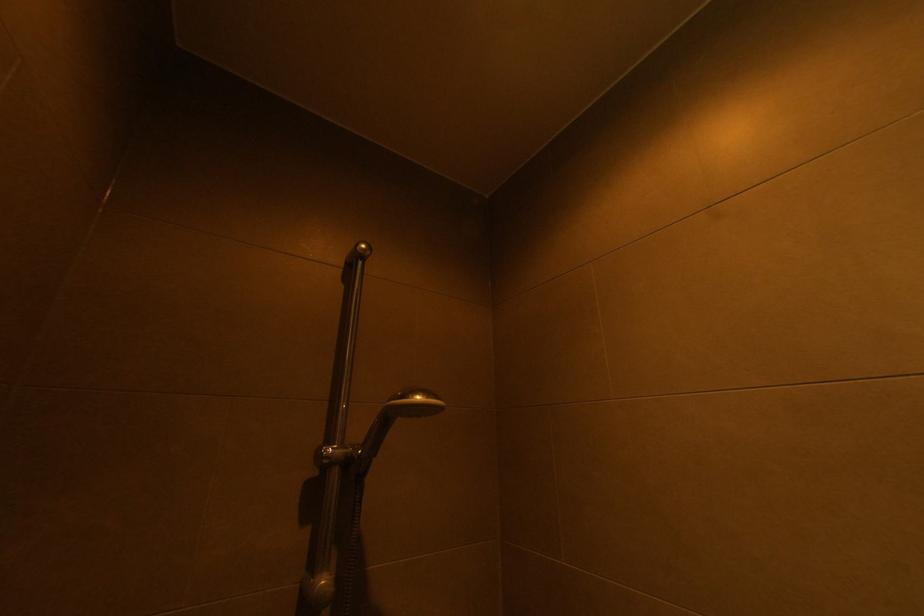
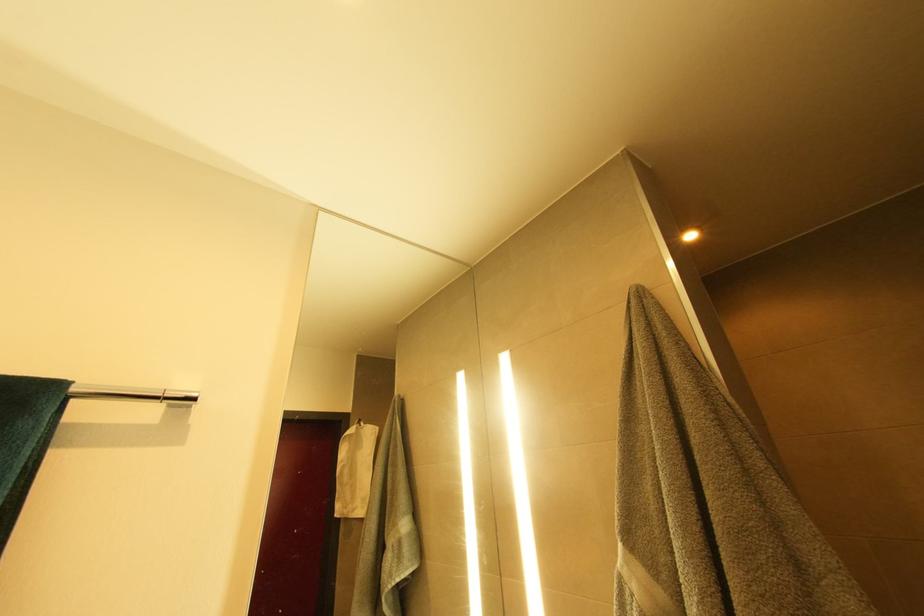
What movement of the cameraman would produce the second image?

The cameraman walked toward left, backward.